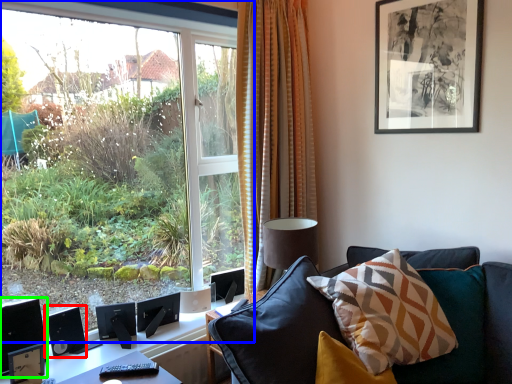
Question: Which object is the closest to the speaker (highlighted by a red box)? Choose among these: window (highlighted by a blue box) or computer monitor (highlighted by a green box).

Choices:
 (A) window
 (B) computer monitor

Answer: (B)